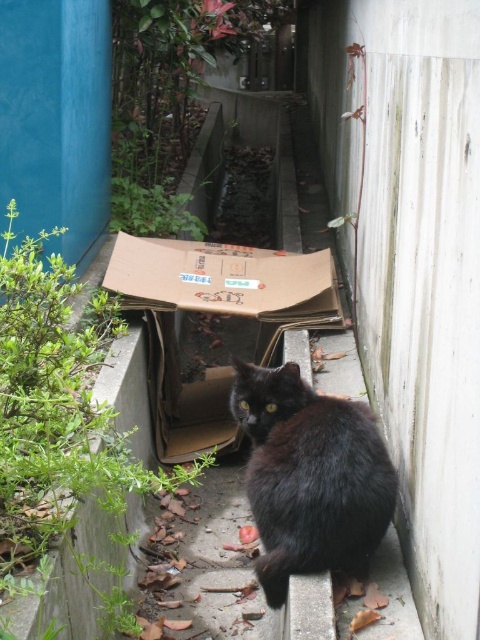
Question: Which object appears farthest from the camera in this image?

Choices:
 (A) black fur cat at center
 (B) brown cardboard box at center

Answer: (B)

Question: Is black fur cat at center positioned at the back of brown cardboard box at center?

Choices:
 (A) no
 (B) yes

Answer: (A)

Question: Can you confirm if black fur cat at center is thinner than brown cardboard box at center?

Choices:
 (A) yes
 (B) no

Answer: (A)

Question: From the image, what is the correct spatial relationship of black fur cat at center in relation to brown cardboard box at center?

Choices:
 (A) left
 (B) right

Answer: (B)

Question: Which point is closer to the camera taking this photo?

Choices:
 (A) (283, 269)
 (B) (252, 464)

Answer: (B)